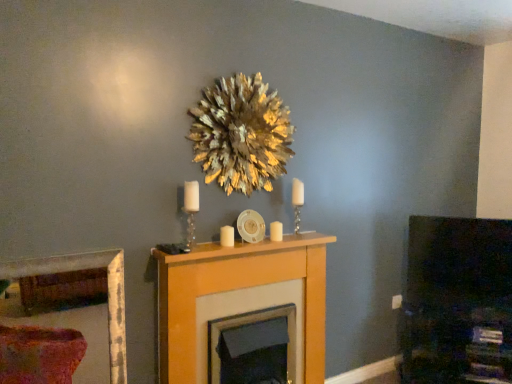
Question: Would you say gold leafy wreath at upper center contains wooden mantel at center?

Choices:
 (A) no
 (B) yes

Answer: (A)

Question: Is gold leafy wreath at upper center facing towards wooden mantel at center?

Choices:
 (A) no
 (B) yes

Answer: (A)

Question: From a real-world perspective, is gold leafy wreath at upper center on top of wooden mantel at center?

Choices:
 (A) no
 (B) yes

Answer: (B)

Question: From the image's perspective, does gold leafy wreath at upper center appear lower than wooden mantel at center?

Choices:
 (A) yes
 (B) no

Answer: (B)

Question: Is gold leafy wreath at upper center bigger than wooden mantel at center?

Choices:
 (A) no
 (B) yes

Answer: (A)

Question: Visually, is wooden picture frame at lower left positioned to the left or to the right of clear glass candle holder at center, the 1th candle holder from the right?

Choices:
 (A) right
 (B) left

Answer: (B)

Question: Is point (102, 324) closer or farther from the camera than point (297, 231)?

Choices:
 (A) closer
 (B) farther

Answer: (B)

Question: Would you say wooden picture frame at lower left is inside or outside clear glass candle holder at center, which ranks as the first candle holder in back-to-front order?

Choices:
 (A) outside
 (B) inside

Answer: (A)

Question: Based on their sizes in the image, would you say wooden picture frame at lower left is bigger or smaller than clear glass candle holder at center, the 1th candle holder from the right?

Choices:
 (A) big
 (B) small

Answer: (A)

Question: Is matte black tv at right spatially inside clear glass candle holder at center, acting as the second candle holder starting from the left, or outside of it?

Choices:
 (A) inside
 (B) outside

Answer: (B)

Question: Considering the positions of matte black tv at right and clear glass candle holder at center, which ranks as the first candle holder in back-to-front order, in the image, is matte black tv at right taller or shorter than clear glass candle holder at center, which ranks as the first candle holder in back-to-front order,?

Choices:
 (A) tall
 (B) short

Answer: (A)

Question: Considering their positions, is matte black tv at right located in front of or behind clear glass candle holder at center, the 1th candle holder from the right?

Choices:
 (A) front
 (B) behind

Answer: (B)

Question: From a real-world perspective, is matte black tv at right above or below clear glass candle holder at center, which ranks as the first candle holder in back-to-front order?

Choices:
 (A) above
 (B) below

Answer: (B)

Question: Considering the positions of gold leafy wreath at upper center and wooden picture frame at lower left in the image, is gold leafy wreath at upper center taller or shorter than wooden picture frame at lower left?

Choices:
 (A) tall
 (B) short

Answer: (A)

Question: Does point (194, 124) appear closer or farther from the camera than point (53, 276)?

Choices:
 (A) closer
 (B) farther

Answer: (A)